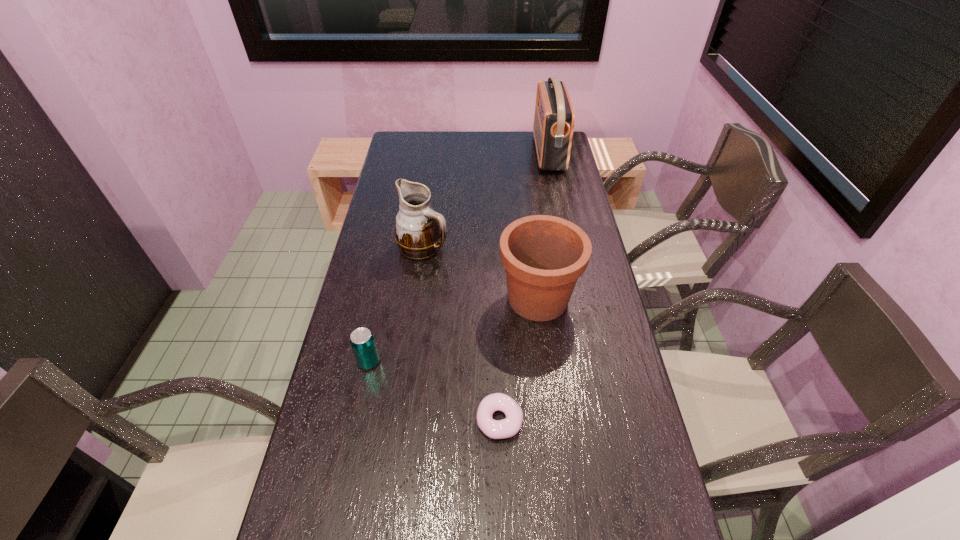
Image resolution: width=960 pixels, height=540 pixels. Identify the location of the tallest object. (554, 118).

Locate an element on the screen. the farthest object is located at coordinates (554, 118).

Locate an element on the screen. The image size is (960, 540). pitcher is located at coordinates (420, 232).

This screenshot has width=960, height=540. Find the location of `the third farthest object`. the third farthest object is located at coordinates (544, 256).

I want to click on the second nearest object, so click(362, 341).

What are the coordinates of `the fourth tallest object` in the screenshot? It's located at (362, 341).

Identify the location of the shortest object. The image size is (960, 540). (506, 428).

You are a GUI agent. You are given a task and a screenshot of the screen. Output one action in this format:
    pyautogui.click(x=<x>, y=<y>)
    Task: Click on the nearest object
    The image size is (960, 540).
    Given the screenshot: What is the action you would take?
    pyautogui.click(x=506, y=428)

Image resolution: width=960 pixels, height=540 pixels. Identify the location of free spot located on the front-facing side of the farthest object. (457, 153).

Find the location of a particular element. The width and height of the screenshot is (960, 540). vacant space located on the front-facing side of the farthest object is located at coordinates (498, 153).